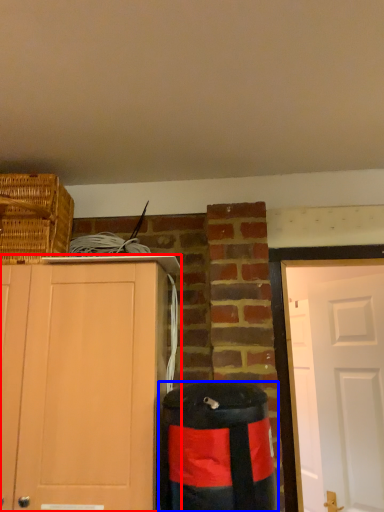
Question: Among these objects, which one is farthest to the camera, cabinetry (highlighted by a red box) or waste container (highlighted by a blue box)?

Choices:
 (A) cabinetry
 (B) waste container

Answer: (A)